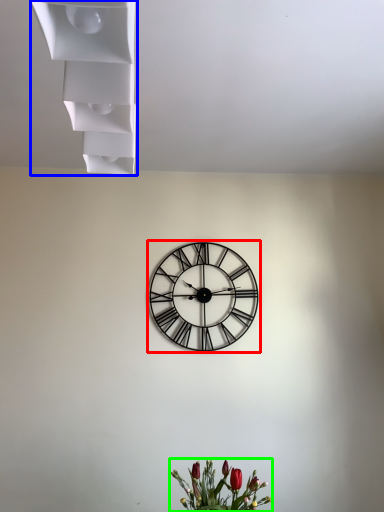
Question: Which object is the farthest from wall clock (highlighted by a red box)? Choose among these: shelf (highlighted by a blue box) or floral arrangement (highlighted by a green box).

Choices:
 (A) shelf
 (B) floral arrangement

Answer: (A)